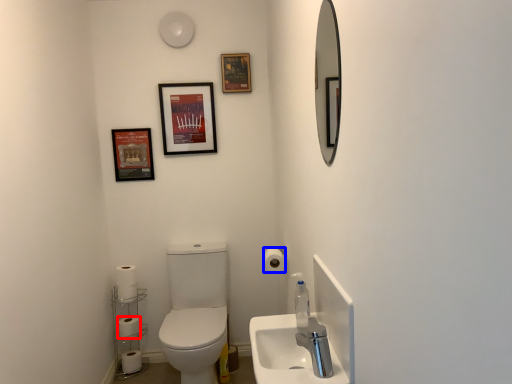
Question: Which of the following is the farthest to the observer, toilet paper (highlighted by a red box) or toilet paper (highlighted by a blue box)?

Choices:
 (A) toilet paper
 (B) toilet paper

Answer: (A)